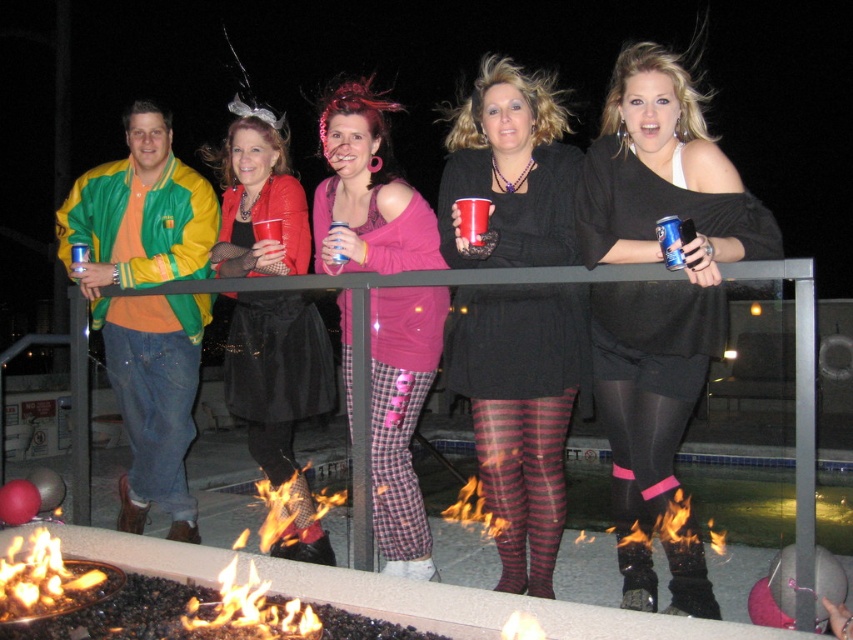
Can you confirm if black matte boots at center is positioned below pink plaid pants at center?

No, black matte boots at center is not below pink plaid pants at center.

The width and height of the screenshot is (853, 640). I want to click on black matte boots at center, so click(659, 260).

Between point (634, 368) and point (376, 493), which one is positioned behind?

The point (376, 493) is behind.

The height and width of the screenshot is (640, 853). In order to click on black matte boots at center in this screenshot , I will do `click(659, 260)`.

Between matte black dress at center and black knit dress at center, which one is positioned higher?

black knit dress at center

Which is in front, point (248, 292) or point (463, 193)?

Point (463, 193)

Where is `matte black dress at center`? The image size is (853, 640). matte black dress at center is located at coordinates (276, 372).

Can you confirm if black satin skirt at center is shorter than jeans at left?

Incorrect, black satin skirt at center's height does not fall short of jeans at left's.

Does black satin skirt at center have a lesser width compared to jeans at left?

No.

Where is `black satin skirt at center`? The image size is (853, 640). black satin skirt at center is located at coordinates (277, 358).